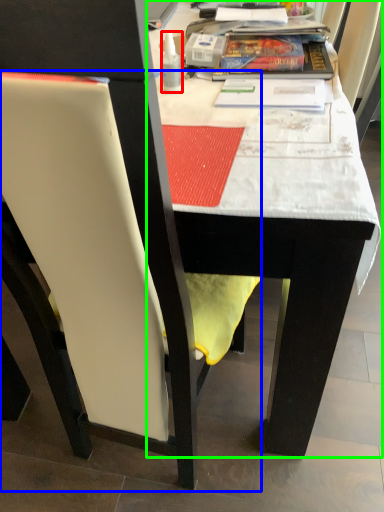
Question: Estimate the real-world distances between objects in this image. Which object is closer to bottle (highlighted by a red box), chair (highlighted by a blue box) or table (highlighted by a green box)?

Choices:
 (A) chair
 (B) table

Answer: (B)